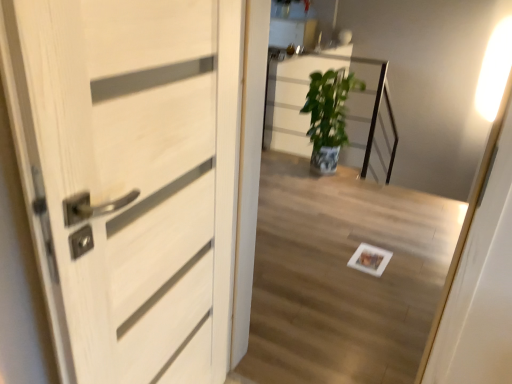
Question: Considering the positions of green glossy plant at center and white glossy light at upper right in the image, is green glossy plant at center wider or thinner than white glossy light at upper right?

Choices:
 (A) thin
 (B) wide

Answer: (B)

Question: Visually, is green glossy plant at center positioned to the left or to the right of white glossy light at upper right?

Choices:
 (A) left
 (B) right

Answer: (A)

Question: Which object is the farthest from the green glossy plant at center?

Choices:
 (A) white glossy light at upper right
 (B) white wood door at left

Answer: (B)

Question: Estimate the real-world distances between objects in this image. Which object is closer to the white wood door at left?

Choices:
 (A) green glossy plant at center
 (B) white glossy light at upper right

Answer: (A)